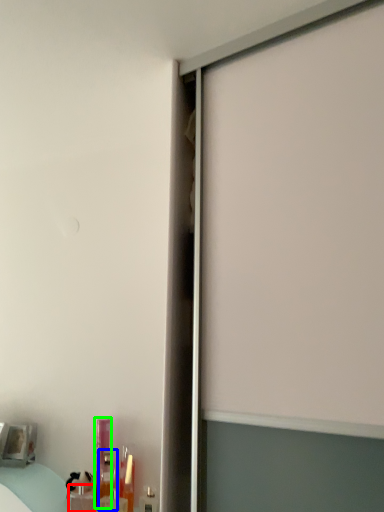
Question: Which is nearer to the toiletry (highlighted by a red box)? toiletry (highlighted by a blue box) or toiletry (highlighted by a green box).

Choices:
 (A) toiletry
 (B) toiletry

Answer: (A)